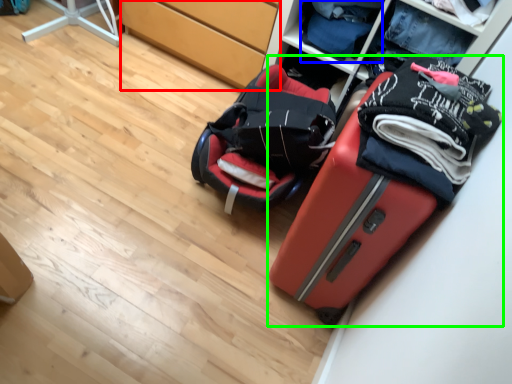
Question: Which object is the farthest from cabinetry (highlighted by a red box)? Choose among these: clothing (highlighted by a blue box) or suitcase (highlighted by a green box).

Choices:
 (A) clothing
 (B) suitcase

Answer: (B)